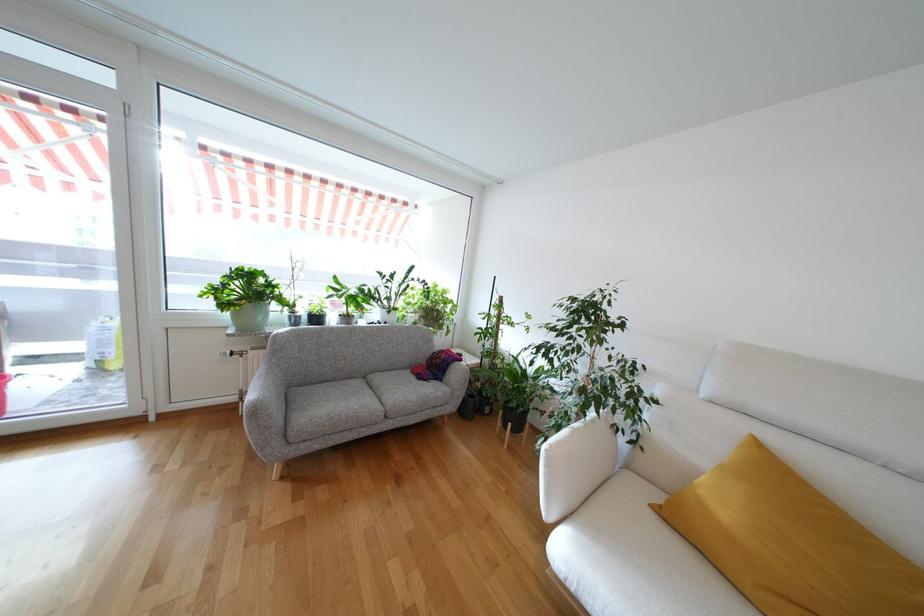
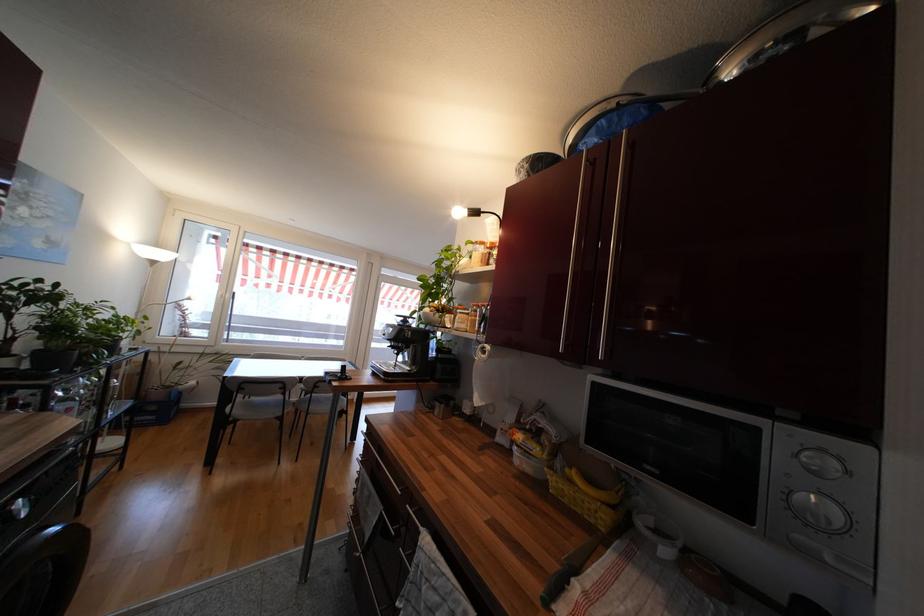
In a continuous first-person perspective shot, in which direction is the camera moving?

The cameraman walked toward left, backward.